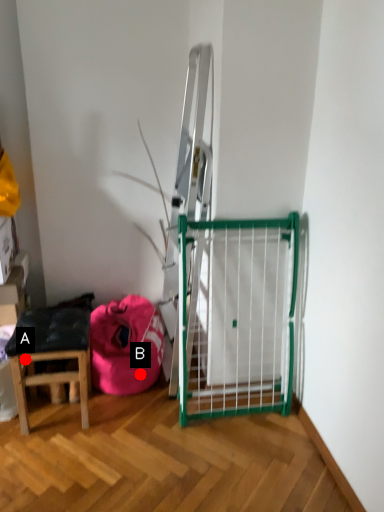
Question: Two points are circled on the image, labeled by A and B beside each circle. Among these points, which one is farthest from the camera?

Choices:
 (A) A is further
 (B) B is further

Answer: (B)